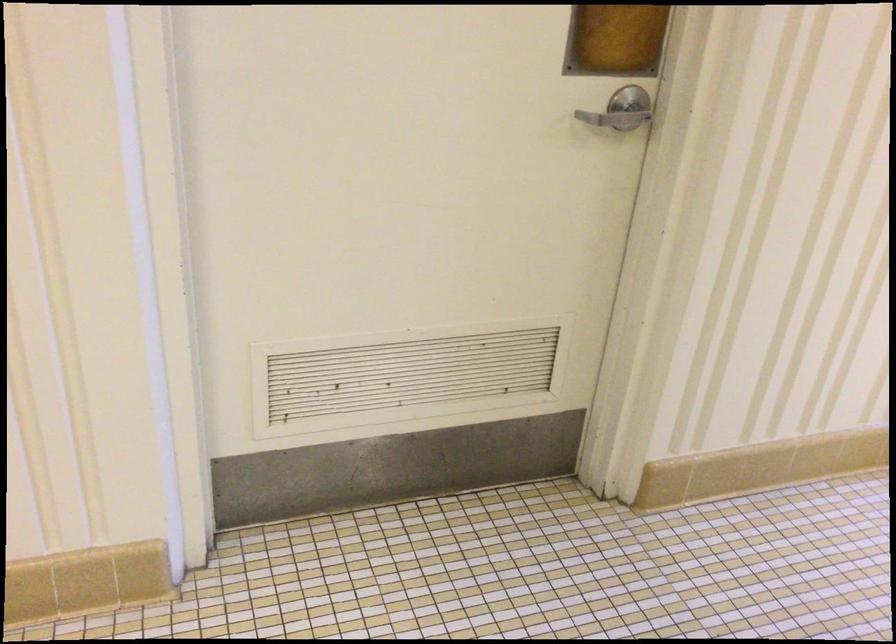
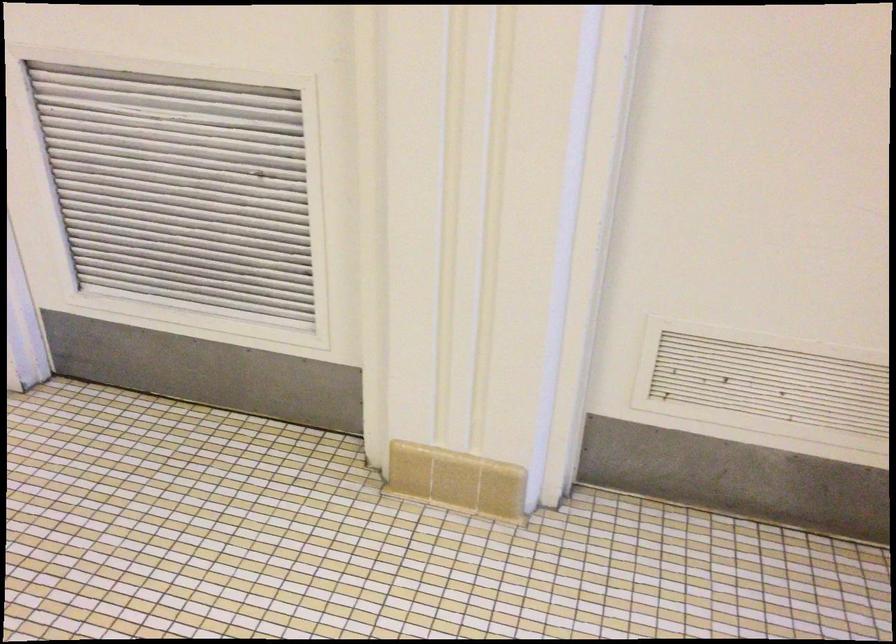
Question: The images are taken continuously from a first-person perspective. In which direction is your viewpoint rotating?

Choices:
 (A) Left
 (B) Right
 (C) Up
 (D) Down

Answer: (A)